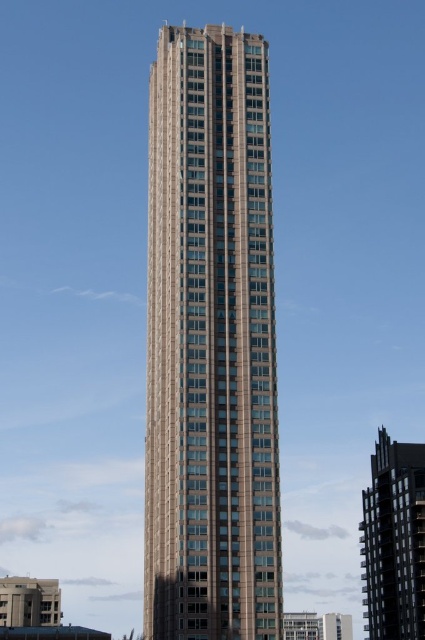
Which is more to the right, brown stone building at center or dark gray concrete building at lower right?

dark gray concrete building at lower right

In the scene shown: Is brown stone building at center shorter than dark gray concrete building at lower right?

No.

Locate an element on the screen. The image size is (425, 640). brown stone building at center is located at coordinates (210, 342).